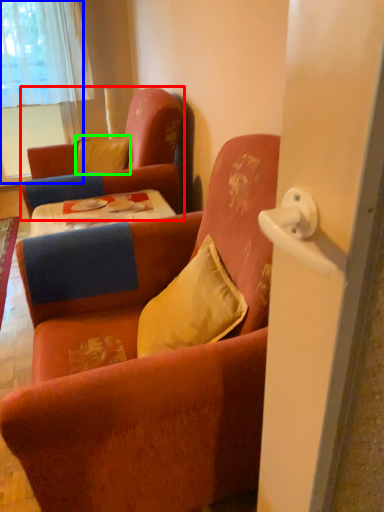
Question: Which object is the farthest from chair (highlighted by a red box)? Choose among these: window (highlighted by a blue box) or pillow (highlighted by a green box).

Choices:
 (A) window
 (B) pillow

Answer: (A)